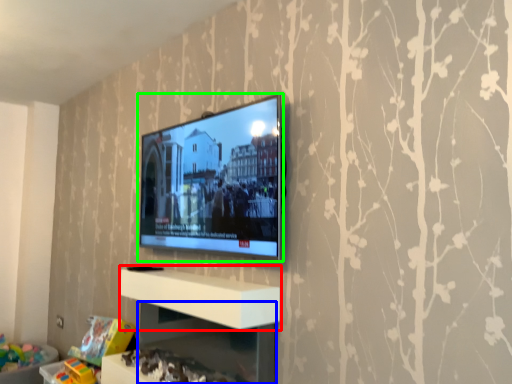
Question: Which is nearer to the shelf (highlighted by a red box)? shelf (highlighted by a blue box) or television (highlighted by a green box).

Choices:
 (A) shelf
 (B) television

Answer: (A)